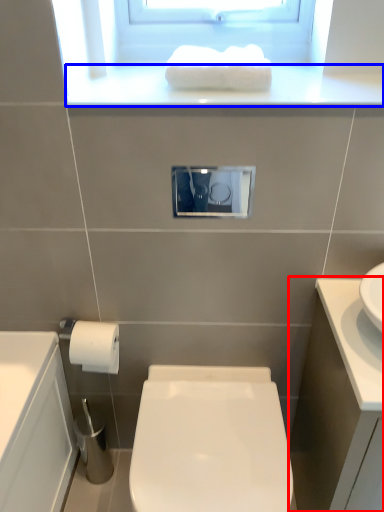
Question: Which of the following is the closest to the observer, bathroom cabinet (highlighted by a red box) or window sill (highlighted by a blue box)?

Choices:
 (A) bathroom cabinet
 (B) window sill

Answer: (A)